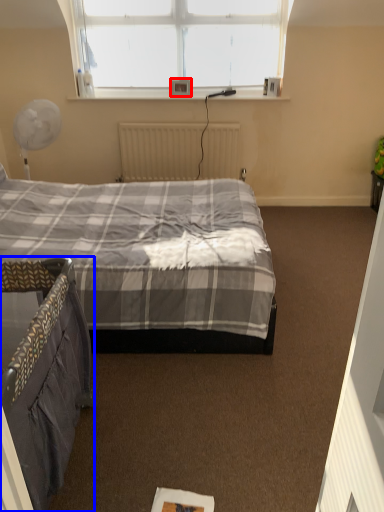
Question: Among these objects, which one is nearest to the camera, picture frame (highlighted by a red box) or bed (highlighted by a blue box)?

Choices:
 (A) picture frame
 (B) bed

Answer: (B)